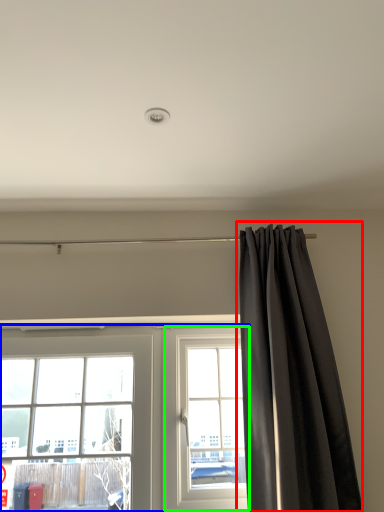
Question: Which is nearer to the curtain (highlighted by a red box)? window (highlighted by a blue box) or window (highlighted by a green box).

Choices:
 (A) window
 (B) window

Answer: (B)